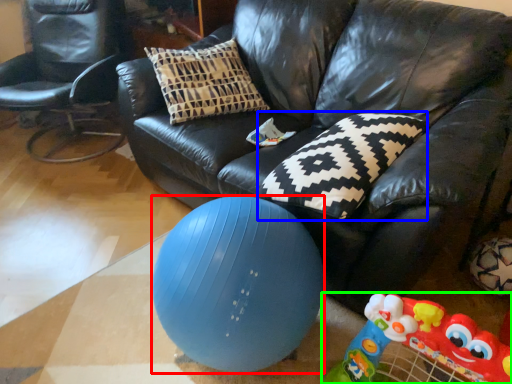
Question: Which object is the farthest from ball (highlighted by a red box)? Choose among these: pillow (highlighted by a blue box) or toy (highlighted by a green box).

Choices:
 (A) pillow
 (B) toy

Answer: (B)